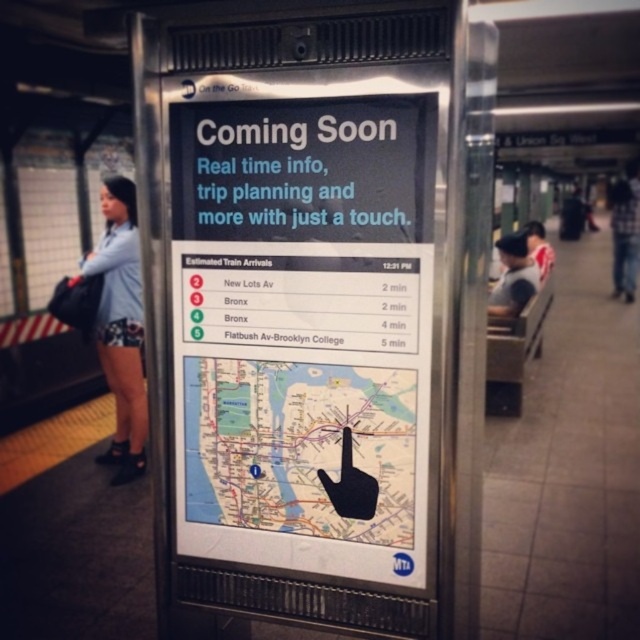
Can you confirm if matte map at center is positioned above dark gray shirt at center?

No, matte map at center is not above dark gray shirt at center.

How far apart are matte map at center and dark gray shirt at center?

matte map at center is 25.56 inches away from dark gray shirt at center.

Is point (378, 371) positioned behind point (512, 276)?

No, (378, 371) is in front of (512, 276).

Where is `matte map at center`? The height and width of the screenshot is (640, 640). matte map at center is located at coordinates (300, 449).

Which is more to the left, matte map at center or denim shorts at left?

Positioned to the left is denim shorts at left.

Is matte map at center smaller than denim shorts at left?

Yes, matte map at center is smaller than denim shorts at left.

Describe the element at coordinates (300, 449) in the screenshot. I see `matte map at center` at that location.

The width and height of the screenshot is (640, 640). Find the location of `matte map at center`. matte map at center is located at coordinates (300, 449).

Does point (106, 336) lie behind point (490, 294)?

Yes.

Is denim shorts at left bigger than dark gray shirt at center?

Correct, denim shorts at left is larger in size than dark gray shirt at center.

Locate an element on the screen. denim shorts at left is located at coordinates point(120,324).